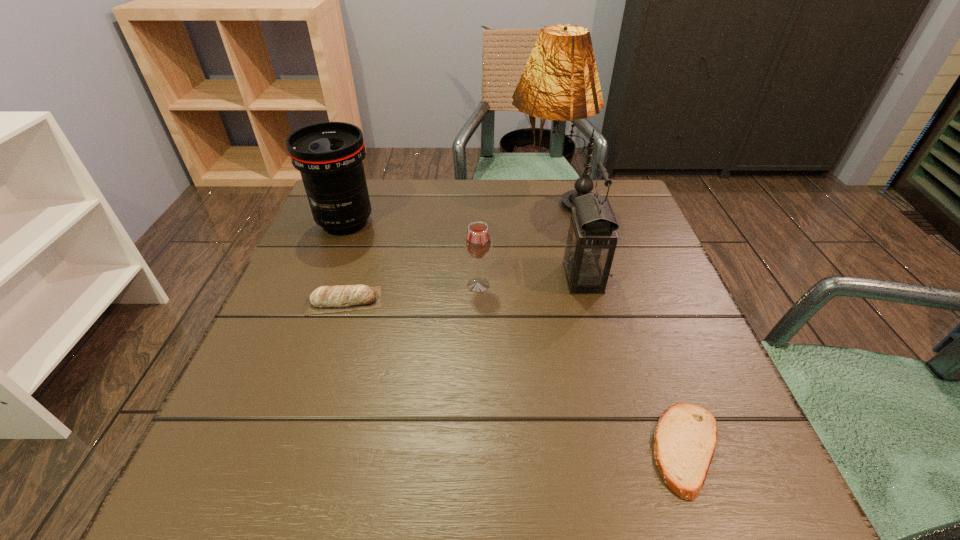
Find the location of a particular element. The image size is (960, 540). vacant space that satisfies the following two spatial constraints: 1. on the front side of the telephoto lens; 2. on the right side of the shorter pita bread is located at coordinates (256, 449).